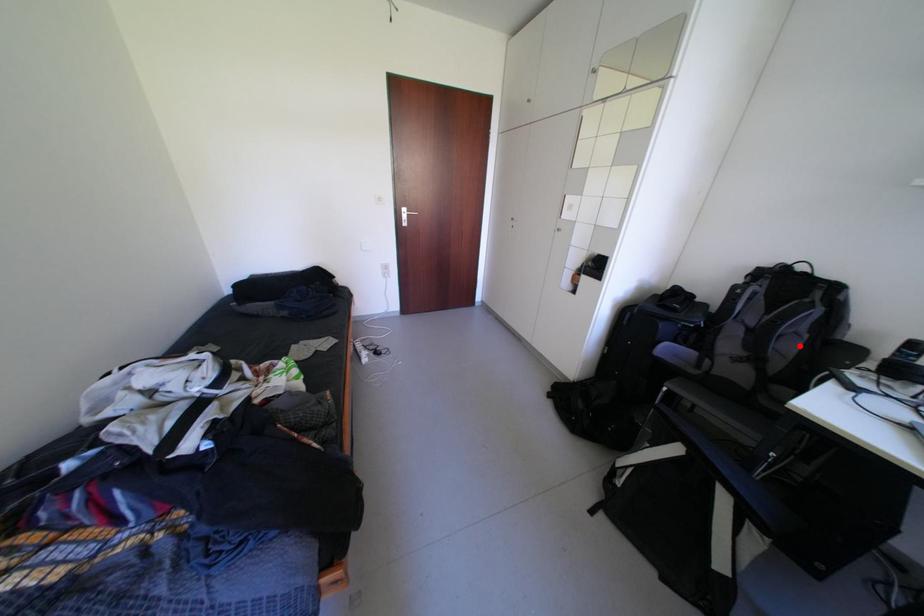
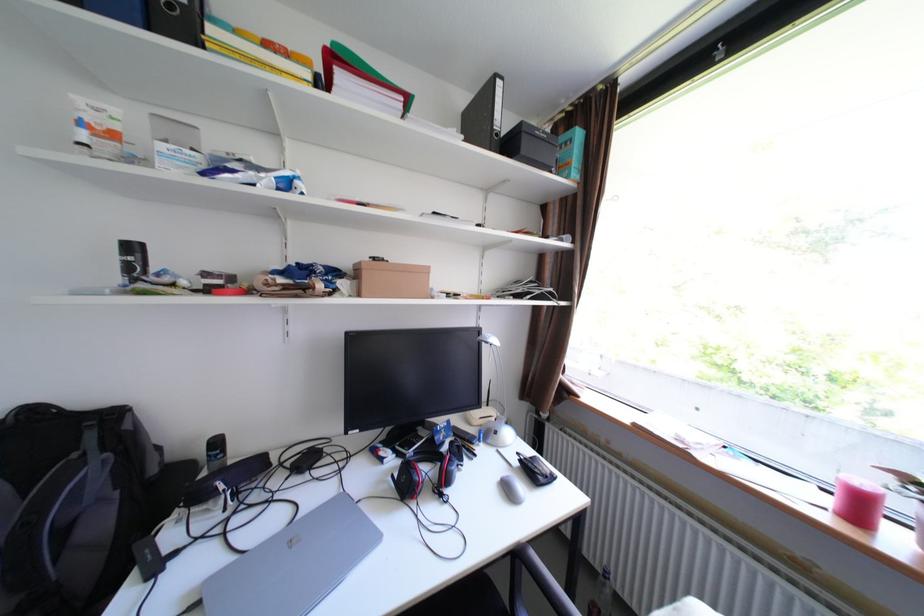
Find the pixel in the second image that matches the highlighted location in the first image.

(110, 524)